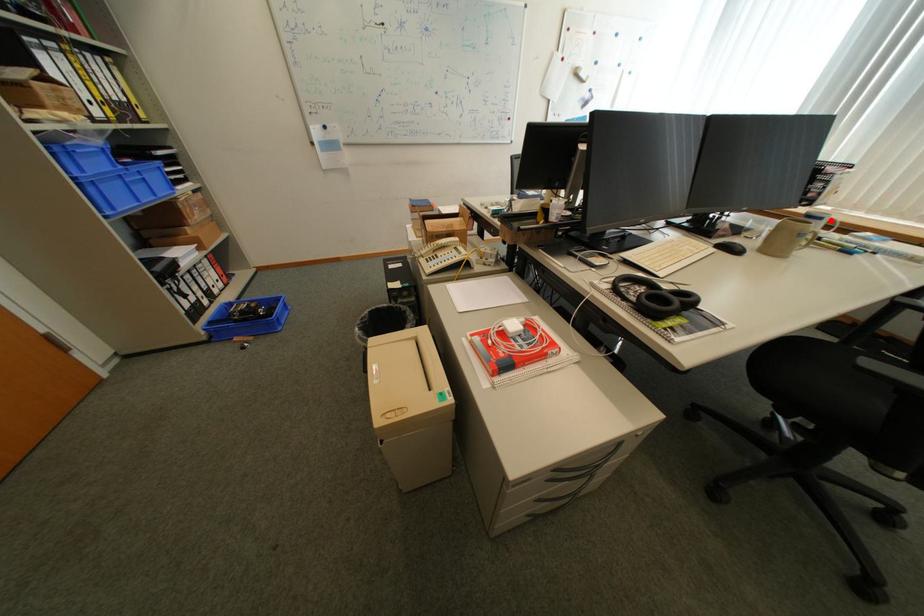
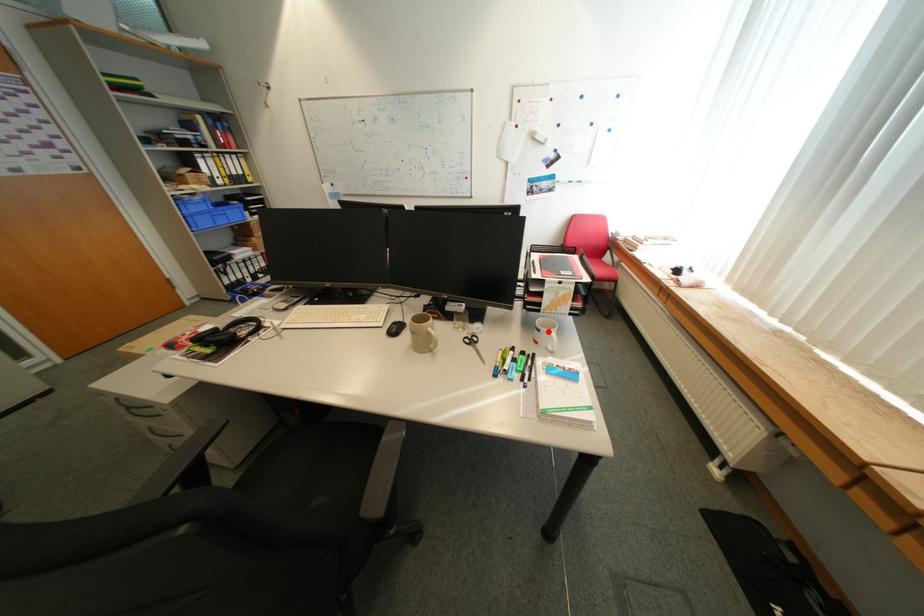
I am providing you with two images of the same scene from different viewpoints. A red point is marked on the first image and another point is marked on the second image. Do the highlighted points in image1 and image2 indicate the same real-world spot?

Yes